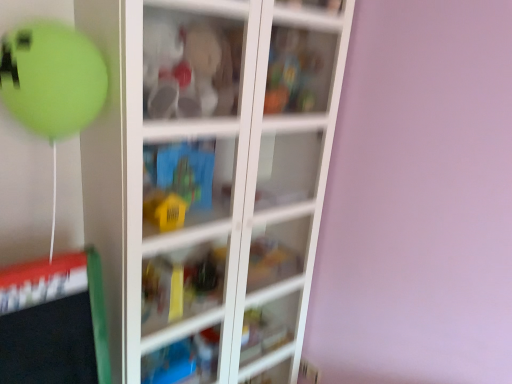
In order to click on transparent plastic cabinet at upper center, which appears as the first cabinet when viewed from the right in this screenshot , I will do `click(298, 70)`.

Considering the relative sizes of transparent plastic cabinet at upper center, arranged as the second cabinet when ordered from the bottom, and transparent glass cabinet at center in the image provided, is transparent plastic cabinet at upper center, arranged as the second cabinet when ordered from the bottom, shorter than transparent glass cabinet at center?

Correct, transparent plastic cabinet at upper center, arranged as the second cabinet when ordered from the bottom, is not as tall as transparent glass cabinet at center.

Relative to transparent glass cabinet at center, is transparent plastic cabinet at upper center, arranged as the second cabinet when ordered from the bottom, in front or behind?

transparent plastic cabinet at upper center, arranged as the second cabinet when ordered from the bottom, is behind transparent glass cabinet at center.

From the image's perspective, which object appears higher, transparent plastic cabinet at upper center, arranged as the 1th cabinet when viewed from the top, or transparent glass cabinet at center?

From the image's view, transparent plastic cabinet at upper center, arranged as the 1th cabinet when viewed from the top, is above.

Based on the photo, which is correct: blue plastic toy at center, the 2th cabinet viewed from the right, is inside transparent plastic cabinet at upper center, arranged as the second cabinet when ordered from the bottom, or outside of it?

blue plastic toy at center, the 2th cabinet viewed from the right, is outside transparent plastic cabinet at upper center, arranged as the second cabinet when ordered from the bottom.

From a real-world perspective, is blue plastic toy at center, which is counted as the second cabinet, starting from the top, under transparent plastic cabinet at upper center, which appears as the first cabinet when viewed from the right?

Yes, from a real-world perspective, blue plastic toy at center, which is counted as the second cabinet, starting from the top, is under transparent plastic cabinet at upper center, which appears as the first cabinet when viewed from the right.

Which is behind, point (209, 158) or point (296, 62)?

Positioned behind is point (296, 62).

Between blue plastic toy at center, which is counted as the second cabinet, starting from the top, and transparent plastic cabinet at upper center, arranged as the 1th cabinet when viewed from the top, which one appears on the right side from the viewer's perspective?

Positioned to the right is transparent plastic cabinet at upper center, arranged as the 1th cabinet when viewed from the top.

Find the location of a particular element. This screenshot has height=384, width=512. shelf on the right of blue plastic toy at center, which is counted as the first cabinet, starting from the bottom is located at coordinates (212, 173).

Which of these two, blue plastic toy at center, which is counted as the second cabinet, starting from the top, or transparent glass cabinet at center, stands taller?

transparent glass cabinet at center is taller.

Which object is further away from the camera taking this photo, blue plastic toy at center, which is counted as the first cabinet, starting from the bottom, or transparent glass cabinet at center?

blue plastic toy at center, which is counted as the first cabinet, starting from the bottom.

Looking at this image, considering the relative sizes of blue plastic toy at center, which is counted as the first cabinet, starting from the bottom, and transparent glass cabinet at center in the image provided, is blue plastic toy at center, which is counted as the first cabinet, starting from the bottom, wider than transparent glass cabinet at center?

No, blue plastic toy at center, which is counted as the first cabinet, starting from the bottom, is not wider than transparent glass cabinet at center.

Which of these two, transparent glass cabinet at center or transparent plastic cabinet at upper center, which appears as the first cabinet when viewed from the right, stands taller?

transparent glass cabinet at center is taller.

Between transparent glass cabinet at center and transparent plastic cabinet at upper center, which appears as the first cabinet when viewed from the right, which one appears on the left side from the viewer's perspective?

transparent glass cabinet at center.

From a real-world perspective, who is located lower, transparent glass cabinet at center or transparent plastic cabinet at upper center, arranged as the 1th cabinet when viewed from the top?

From a 3D spatial view, transparent glass cabinet at center is below.

From the image's perspective, would you say transparent glass cabinet at center is shown under blue plastic toy at center, which is counted as the second cabinet, starting from the top?

Yes, from the image's perspective, transparent glass cabinet at center is below blue plastic toy at center, which is counted as the second cabinet, starting from the top.

In terms of width, does transparent glass cabinet at center look wider or thinner when compared to blue plastic toy at center, the 1th cabinet in the left-to-right sequence?

Clearly, transparent glass cabinet at center has more width compared to blue plastic toy at center, the 1th cabinet in the left-to-right sequence.

Does transparent glass cabinet at center have a lesser height compared to blue plastic toy at center, which is counted as the first cabinet, starting from the bottom?

Incorrect, the height of transparent glass cabinet at center does not fall short of that of blue plastic toy at center, which is counted as the first cabinet, starting from the bottom.

Between transparent glass cabinet at center and blue plastic toy at center, which is counted as the second cabinet, starting from the top, which one has larger size?

transparent glass cabinet at center.

Is transparent plastic cabinet at upper center, arranged as the second cabinet when ordered from the bottom, looking in the opposite direction of blue plastic toy at center, which is counted as the second cabinet, starting from the top?

That's not correct — transparent plastic cabinet at upper center, arranged as the second cabinet when ordered from the bottom, is not looking away from blue plastic toy at center, which is counted as the second cabinet, starting from the top.

In the scene shown: Is blue plastic toy at center, which is counted as the first cabinet, starting from the bottom, inside transparent plastic cabinet at upper center, arranged as the second cabinet when ordered from the bottom?

No, transparent plastic cabinet at upper center, arranged as the second cabinet when ordered from the bottom, does not contain blue plastic toy at center, which is counted as the first cabinet, starting from the bottom.

Based on the photo, who is shorter, transparent plastic cabinet at upper center, which appears as the first cabinet when viewed from the right, or blue plastic toy at center, which is counted as the second cabinet, starting from the top?

With less height is blue plastic toy at center, which is counted as the second cabinet, starting from the top.

Does point (277, 110) come in front of point (220, 150)?

Yes.

I want to click on cabinet that appears on the right of transparent glass cabinet at center, so click(298, 70).

Identify the location of cabinet that appears behind the blue plastic toy at center, the 1th cabinet in the left-to-right sequence. Image resolution: width=512 pixels, height=384 pixels. (298, 70).

Estimate the real-world distances between objects in this image. Which object is further from transparent plastic cabinet at upper center, arranged as the second cabinet when ordered from the bottom, blue plastic toy at center, the 1th cabinet in the left-to-right sequence, or transparent glass cabinet at center?

Answer: blue plastic toy at center, the 1th cabinet in the left-to-right sequence, lies further to transparent plastic cabinet at upper center, arranged as the second cabinet when ordered from the bottom, than the other object.

Looking at the image, which one is located further to transparent plastic cabinet at upper center, marked as the second cabinet in a left-to-right arrangement, transparent glass cabinet at center or blue plastic toy at center, the 1th cabinet in the left-to-right sequence?

blue plastic toy at center, the 1th cabinet in the left-to-right sequence.

Which object lies nearer to the anchor point blue plastic toy at center, the 2th cabinet viewed from the right, transparent glass cabinet at center or transparent plastic cabinet at upper center, which appears as the first cabinet when viewed from the right?

transparent glass cabinet at center is closer to blue plastic toy at center, the 2th cabinet viewed from the right.

Looking at this image, looking at the image, which one is located further to transparent glass cabinet at center, transparent plastic cabinet at upper center, which appears as the first cabinet when viewed from the right, or blue plastic toy at center, which is counted as the second cabinet, starting from the top?

Based on the image, transparent plastic cabinet at upper center, which appears as the first cabinet when viewed from the right, appears to be further to transparent glass cabinet at center.

Based on their spatial positions, is blue plastic toy at center, the 1th cabinet in the left-to-right sequence, or transparent plastic cabinet at upper center, marked as the second cabinet in a left-to-right arrangement, closer to transparent glass cabinet at center?

The object closer to transparent glass cabinet at center is blue plastic toy at center, the 1th cabinet in the left-to-right sequence.

Based on their spatial positions, is transparent plastic cabinet at upper center, arranged as the second cabinet when ordered from the bottom, or transparent glass cabinet at center further from blue plastic toy at center, the 2th cabinet viewed from the right?

Based on the image, transparent plastic cabinet at upper center, arranged as the second cabinet when ordered from the bottom, appears to be further to blue plastic toy at center, the 2th cabinet viewed from the right.

At what (x,y) coordinates should I click in order to perform the action: click on cabinet between transparent plastic cabinet at upper center, arranged as the second cabinet when ordered from the bottom, and transparent glass cabinet at center vertically. Please return your answer as a coordinate pair (x, y). Looking at the image, I should click on (187, 184).